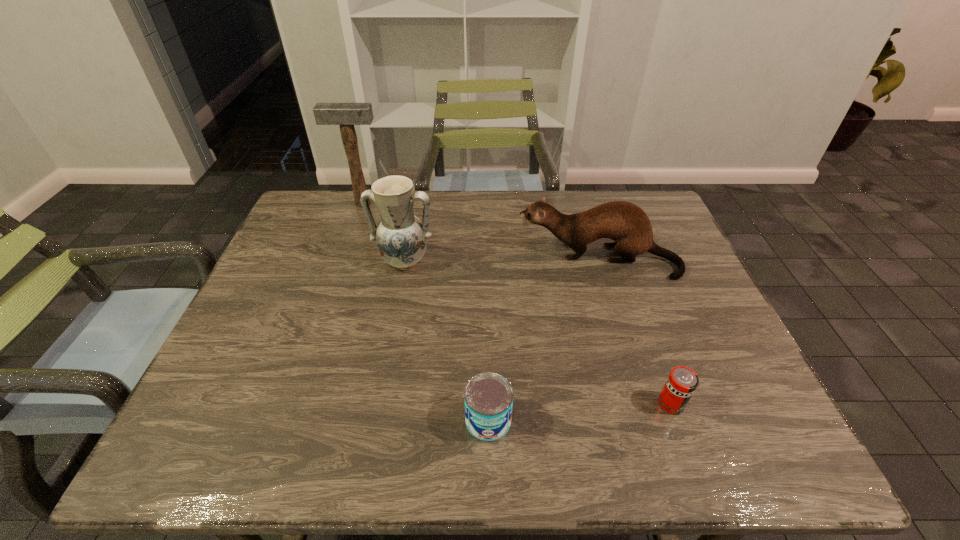
The height and width of the screenshot is (540, 960). I want to click on free space located at the face of the third tallest object, so (472, 259).

This screenshot has width=960, height=540. Find the location of `vacant space situated 0.090m at the face of the third tallest object`. vacant space situated 0.090m at the face of the third tallest object is located at coordinates (487, 259).

The width and height of the screenshot is (960, 540). Identify the location of vacant position located 0.200m on the back of the right can. (642, 322).

In order to click on free spot located on the right of the left can in this screenshot , I will do `click(625, 420)`.

This screenshot has width=960, height=540. Find the location of `object that is at the far edge`. object that is at the far edge is located at coordinates (346, 115).

You are a GUI agent. You are given a task and a screenshot of the screen. Output one action in this format:
    pyautogui.click(x=<x>, y=<y>)
    Task: Click on the object that is positioned at the near edge
    This screenshot has width=960, height=540.
    Given the screenshot: What is the action you would take?
    (488, 396)

The image size is (960, 540). I want to click on object at the left edge, so click(346, 115).

Identify the location of object that is positioned at the right edge. (626, 223).

The height and width of the screenshot is (540, 960). What are the coordinates of `object present at the far left corner` in the screenshot? It's located at (346, 115).

The width and height of the screenshot is (960, 540). I want to click on vacant space at the far edge of the desktop, so click(x=520, y=221).